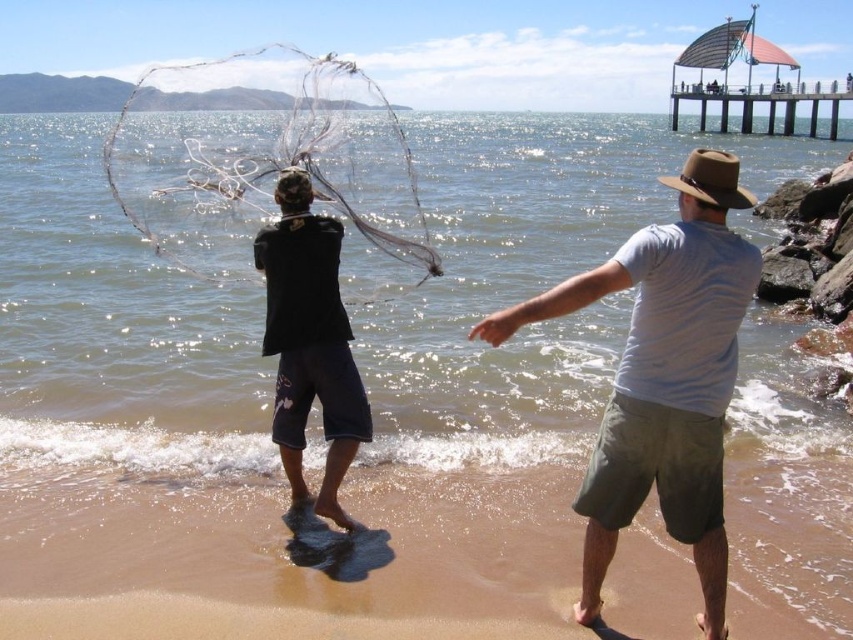
Which is more to the right, transparent nylon fishing net at center or white cotton shirt at center?

white cotton shirt at center is more to the right.

Where is `transparent nylon fishing net at center`? This screenshot has height=640, width=853. transparent nylon fishing net at center is located at coordinates (268, 164).

What do you see at coordinates (268, 164) in the screenshot?
I see `transparent nylon fishing net at center` at bounding box center [268, 164].

The height and width of the screenshot is (640, 853). I want to click on transparent nylon fishing net at center, so click(268, 164).

Between black cotton shirt at center and wooden pier at upper right, which one is positioned lower?

black cotton shirt at center

Can you confirm if black cotton shirt at center is thinner than wooden pier at upper right?

Indeed, black cotton shirt at center has a lesser width compared to wooden pier at upper right.

Where is `black cotton shirt at center`? The width and height of the screenshot is (853, 640). black cotton shirt at center is located at coordinates (309, 342).

Where is `black cotton shirt at center`? This screenshot has width=853, height=640. black cotton shirt at center is located at coordinates (309, 342).

Which is behind, point (618, 250) or point (691, 93)?

The point (691, 93) is behind.

Can you confirm if white cotton shirt at center is taller than wooden pier at upper right?

No, white cotton shirt at center is not taller than wooden pier at upper right.

Is point (636, 464) closer to camera compared to point (724, 118)?

That is True.

Identify the location of white cotton shirt at center. The width and height of the screenshot is (853, 640). (663, 376).